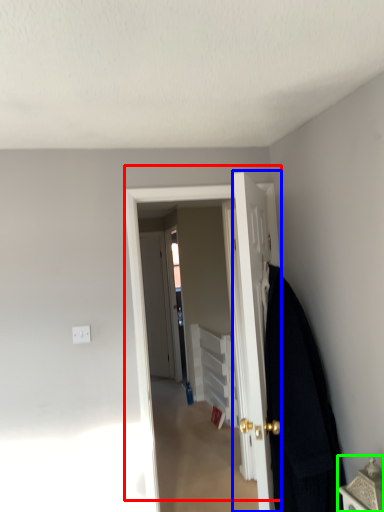
Question: Which object is positioned closest to door (highlighted by a red box)? Select from door (highlighted by a blue box) and furniture (highlighted by a green box).

Choices:
 (A) door
 (B) furniture

Answer: (A)